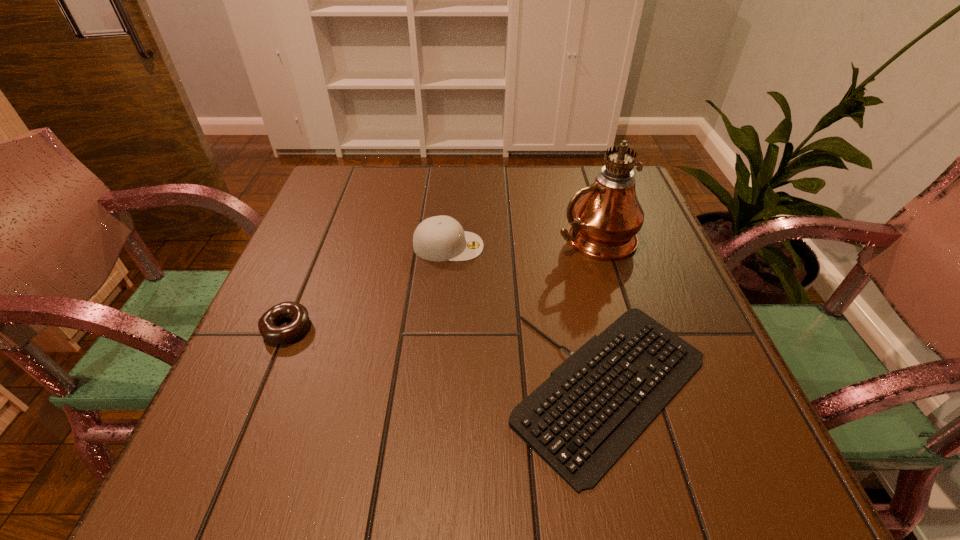
Identify the location of the tallest object. (605, 217).

At what (x,y) coordinates should I click in order to perform the action: click on cap. Please return your answer as a coordinate pair (x, y). Image resolution: width=960 pixels, height=540 pixels. Looking at the image, I should click on (440, 238).

The width and height of the screenshot is (960, 540). I want to click on the third shortest object, so click(440, 238).

Locate an element on the screen. This screenshot has height=540, width=960. doughnut is located at coordinates click(267, 324).

Where is `the third tallest object`? This screenshot has width=960, height=540. the third tallest object is located at coordinates (267, 324).

Identify the location of the shortest object. This screenshot has width=960, height=540. (594, 405).

Where is `vacant space located on the back of the oil lamp`? Image resolution: width=960 pixels, height=540 pixels. vacant space located on the back of the oil lamp is located at coordinates (580, 191).

I want to click on free space located 0.330m on the front-facing side of the third shortest object, so click(x=627, y=246).

Image resolution: width=960 pixels, height=540 pixels. I want to click on blank area located 0.240m on the right of the second shortest object, so click(x=438, y=329).

What are the coordinates of `vacant region located 0.400m on the back of the computer keyboard` in the screenshot? It's located at (564, 200).